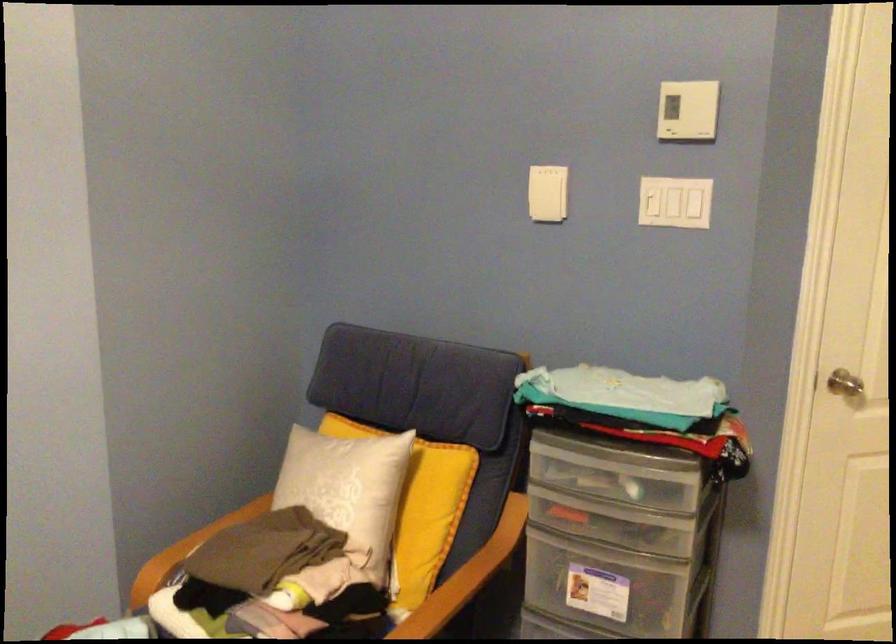
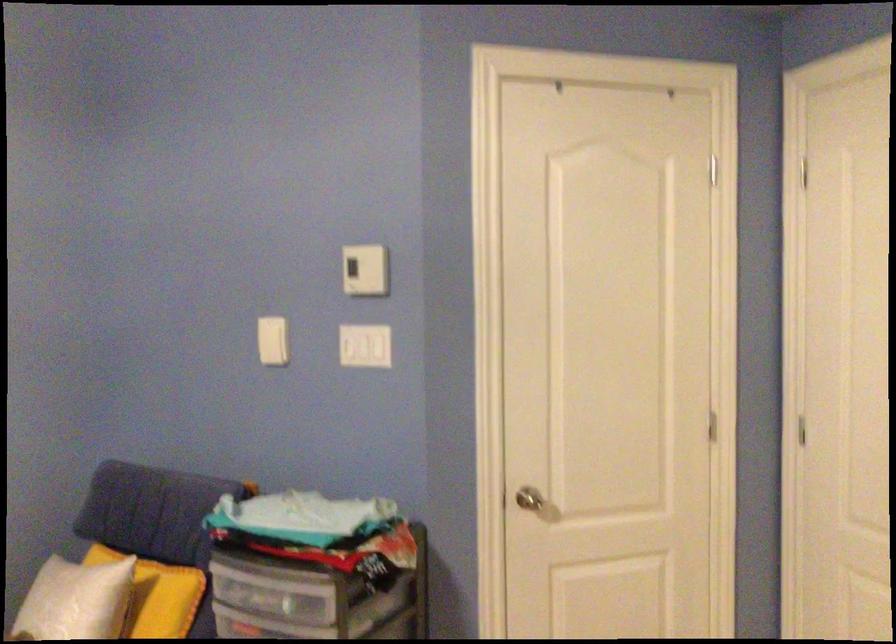
Find the pixel in the second image that matches [593,474] in the first image.

(270, 592)